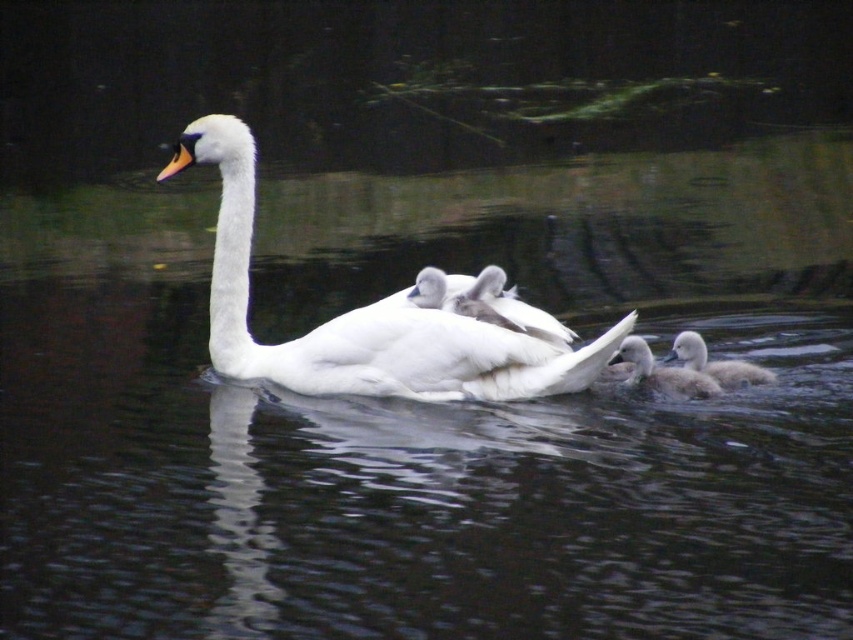
Measure the distance between point [505,371] and camera.

15.12 feet

Is point (495, 330) positioned in front of point (697, 352)?

Yes, it is in front of point (697, 352).

You are a GUI agent. You are given a task and a screenshot of the screen. Output one action in this format:
    pyautogui.click(x=<x>, y=<y>)
    Task: Click on the white feathered swan at center
    This screenshot has width=853, height=640.
    Given the screenshot: What is the action you would take?
    pyautogui.click(x=367, y=317)

Is white fluffy swan at center smaller than white fluffy duckling at lower right?

Incorrect, white fluffy swan at center is not smaller in size than white fluffy duckling at lower right.

Is white fluffy swan at center above white fluffy duckling at lower right?

Yes.

Does point (453, 289) come farther from viewer compared to point (740, 365)?

No.

The width and height of the screenshot is (853, 640). Find the location of `white fluffy swan at center`. white fluffy swan at center is located at coordinates (485, 301).

Does soft gray downy duckling at lower right have a smaller size compared to white fluffy duckling at lower right?

No, soft gray downy duckling at lower right is not smaller than white fluffy duckling at lower right.

Is soft gray downy duckling at lower right behind white fluffy duckling at lower right?

No.

Between point (689, 381) and point (670, 358), which one is positioned in front?

Point (689, 381) is more forward.

Find the location of a particular element. The height and width of the screenshot is (640, 853). soft gray downy duckling at lower right is located at coordinates (657, 372).